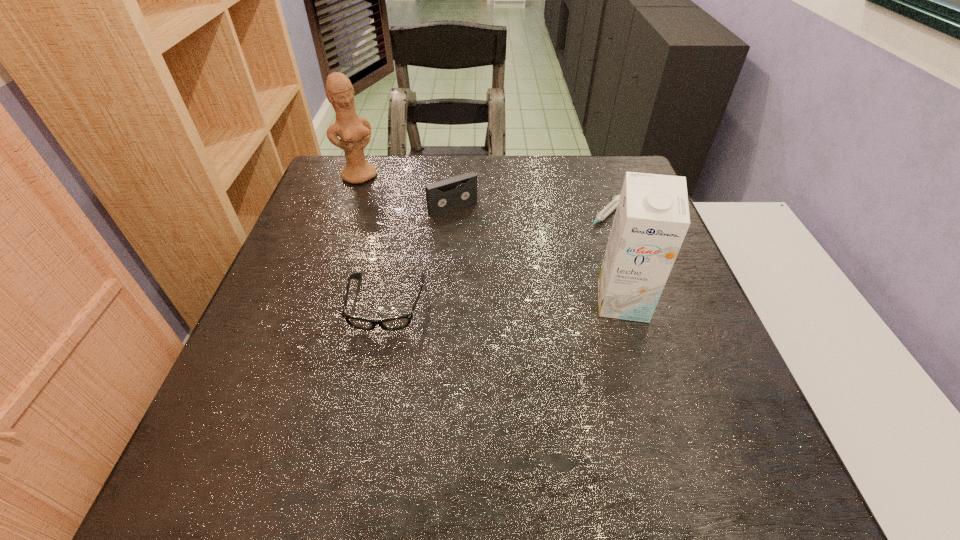
Identify the location of object that is at the left edge. This screenshot has width=960, height=540. (355, 132).

Image resolution: width=960 pixels, height=540 pixels. Find the location of `carton at the right edge`. carton at the right edge is located at coordinates point(652,218).

Locate an element on the screen. This screenshot has width=960, height=540. syringe at the right edge is located at coordinates (613, 204).

You are a GUI agent. You are given a task and a screenshot of the screen. Output one action in this format:
    pyautogui.click(x=<x>, y=<y>)
    Task: Click on the object located in the far left corner section of the desktop
    This screenshot has height=540, width=960.
    Given the screenshot: What is the action you would take?
    pyautogui.click(x=355, y=132)

Find the location of a particular element. object that is at the far right corner is located at coordinates (613, 204).

Locate an element on the screen. The image size is (960, 540). vacant space at the far edge of the desktop is located at coordinates (494, 163).

In order to click on free location at the left edge in this screenshot , I will do `click(339, 261)`.

In order to click on free space at the right edge of the desktop in this screenshot , I will do `click(588, 204)`.

In the image, there is a desktop. Find the location of `vacant space at the far left corner`. vacant space at the far left corner is located at coordinates (366, 191).

Identify the location of free location at the near left corner of the desktop. (212, 413).